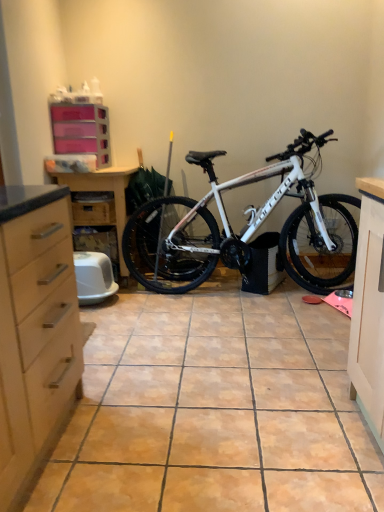
Question: Is wooden drawer at center-left spatially inside white matte bicycle at center, or outside of it?

Choices:
 (A) outside
 (B) inside

Answer: (A)

Question: Considering the positions of point (105, 208) and point (221, 256), is point (105, 208) closer or farther from the camera than point (221, 256)?

Choices:
 (A) closer
 (B) farther

Answer: (B)

Question: Estimate the real-world distances between objects in this image. Which object is closer to the white matte bicycle at center?

Choices:
 (A) wooden drawer at center-left
 (B) matte wood dresser at left
 (C) pink plastic drawers at upper left

Answer: (B)

Question: Estimate the real-world distances between objects in this image. Which object is closer to the wooden drawer at center-left?

Choices:
 (A) pink plastic drawers at upper left
 (B) white matte bicycle at center
 (C) matte wood dresser at left

Answer: (C)